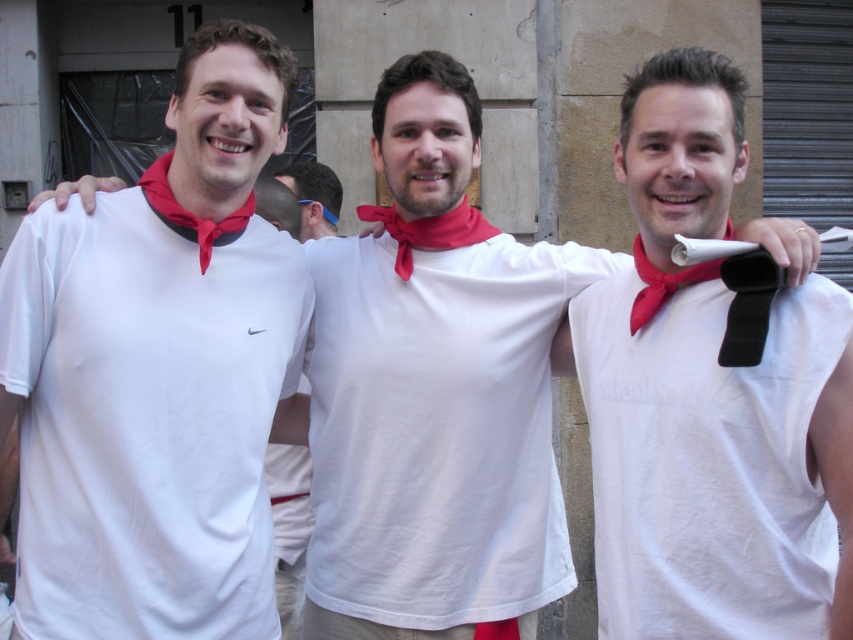
You are standing in front of the three individuals in the image. There are two points marked on the image. The first point is at coordinate point (173, 221) and the second point is at coordinate point (299, 230). Which of these two points is closer to you?

Point (173, 221) is closer to the viewer than point (299, 230).

You are a photographer standing at a distance. You want to capture a closeup shot of the red satin bow tie at left without moving the subject. Can you adjust your camera zoom to focus on it effectively?

The red satin bow tie at left is 12.02 feet away from the viewer. Since this distance is manageable with a camera zoom, you can adjust the zoom to focus on it effectively without needing to move closer.